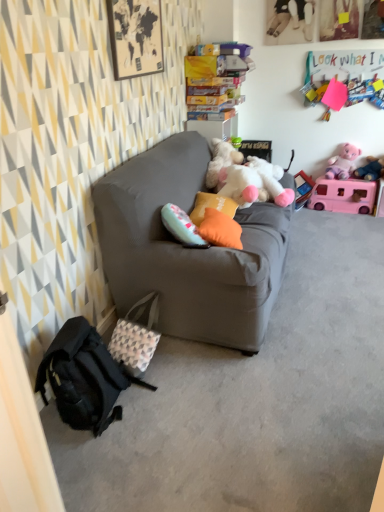
Identify the location of vacant area that lies in front of matte gray couch at center. (264, 400).